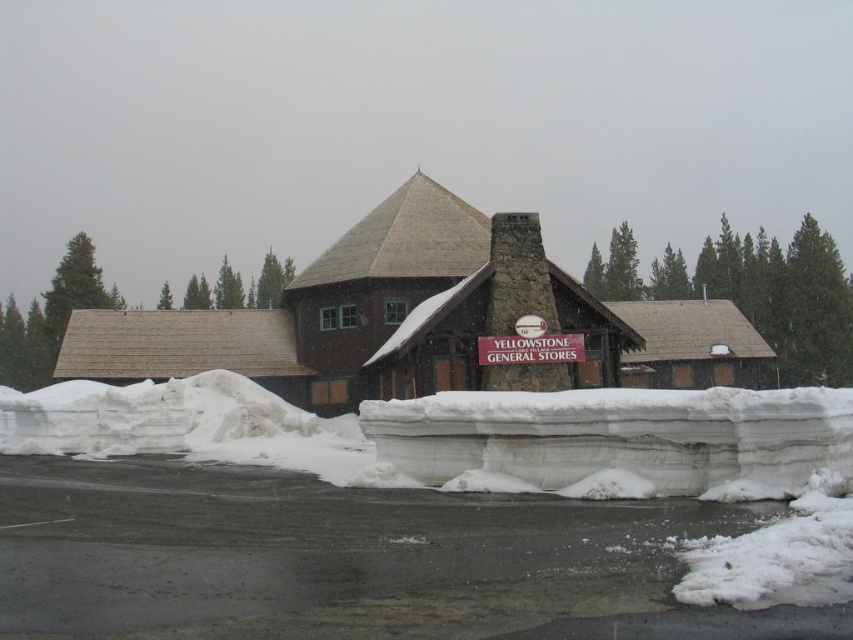
Question: Which point appears closest to the camera in this image?

Choices:
 (A) (560, 360)
 (B) (839, 388)

Answer: (B)

Question: Is white snowdrift at lower center to the right of yellowstone general stores at center from the viewer's perspective?

Choices:
 (A) no
 (B) yes

Answer: (B)

Question: Does white snowdrift at lower center have a smaller size compared to yellowstone general stores at center?

Choices:
 (A) yes
 (B) no

Answer: (A)

Question: Can you confirm if white snowdrift at lower center is bigger than yellowstone general stores at center?

Choices:
 (A) no
 (B) yes

Answer: (A)

Question: Which point appears farthest from the camera in this image?

Choices:
 (A) (646, 449)
 (B) (531, 349)

Answer: (B)